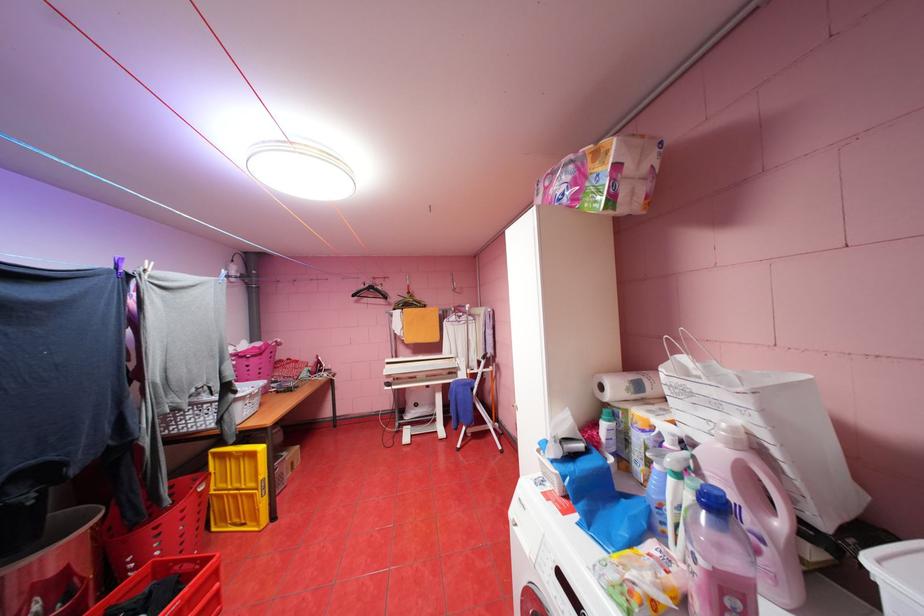
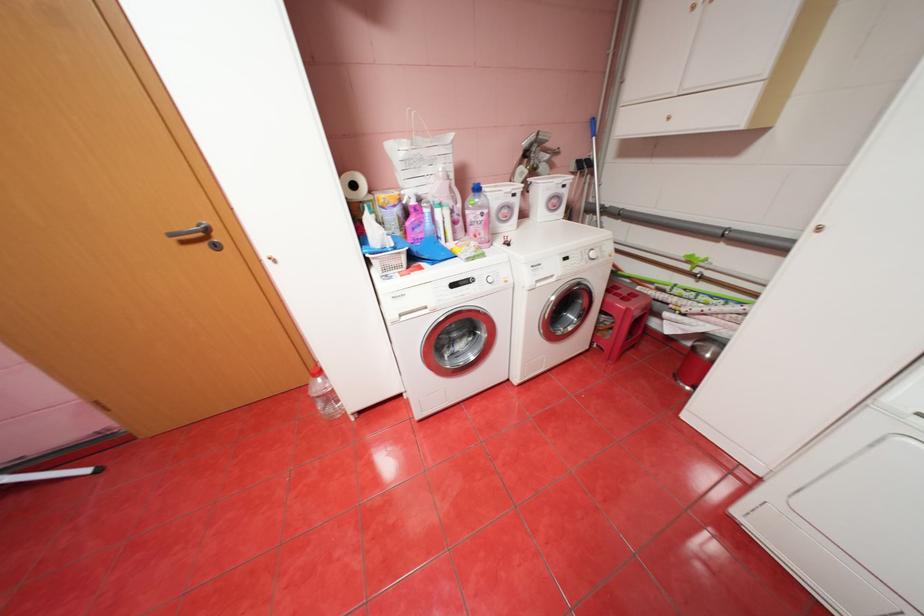
Where in the second image is the point corresponding to pixel 610 387 from the first image?

(362, 185)